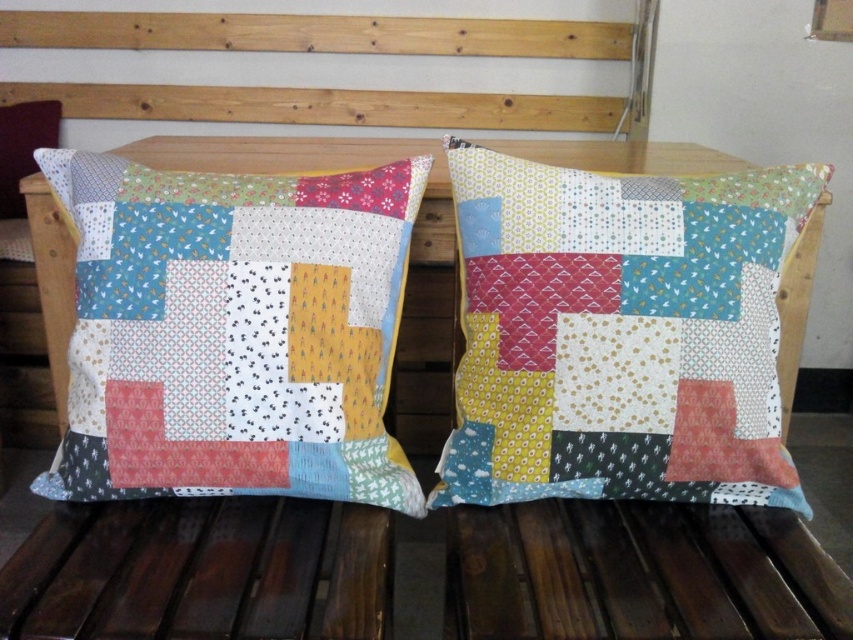
You are arranging decorative pillows on a shelf. The shelf has limited space, and you need to place both the patchwork fabric pillow at center and the patchwork fabric pillow at left. Which pillow should you place first to ensure both fit on the shelf?

The patchwork fabric pillow at left should be placed first because it is smaller in size compared to the patchwork fabric pillow at center, allowing more space for the larger pillow afterward.

Based on the photo, you are sitting on a wooden bench and want to pick up the closest pillow to you. Which one should you choose between the patchwork fabric pillow at center and the patchwork fabric pillow at left?

The patchwork fabric pillow at center is closer to you, so you should choose the patchwork fabric pillow at center.

You are arranging decorative pillows on a shelf. You have the patchwork fabric pillow at center and the patchwork fabric pillow at left. Which pillow is closer to the front of the shelf?

The patchwork fabric pillow at left is closer to the front of the shelf because the patchwork fabric pillow at center is positioned under it.